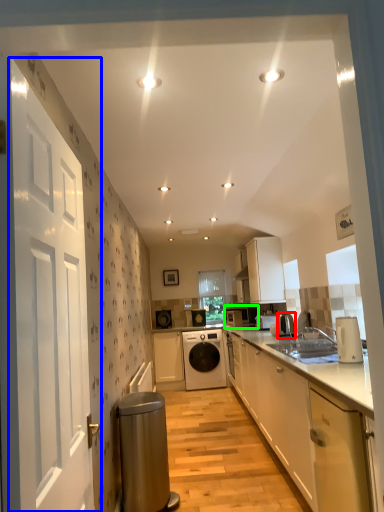
Question: Based on their relative distances, which object is farther from appliance (highlighted by a red box)? Choose from door (highlighted by a blue box) and appliance (highlighted by a green box).

Choices:
 (A) door
 (B) appliance

Answer: (A)